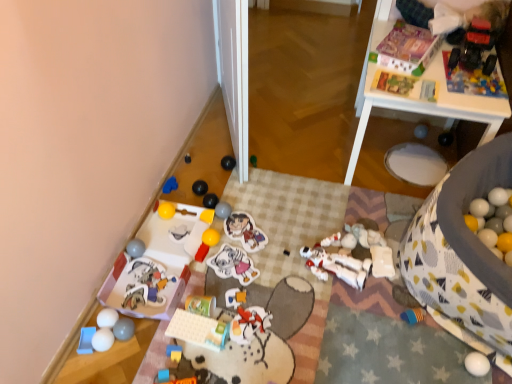
This screenshot has width=512, height=384. Identify the location of free space behind white matte balls at lower left, the 25th toy positioned from the right. (126, 297).